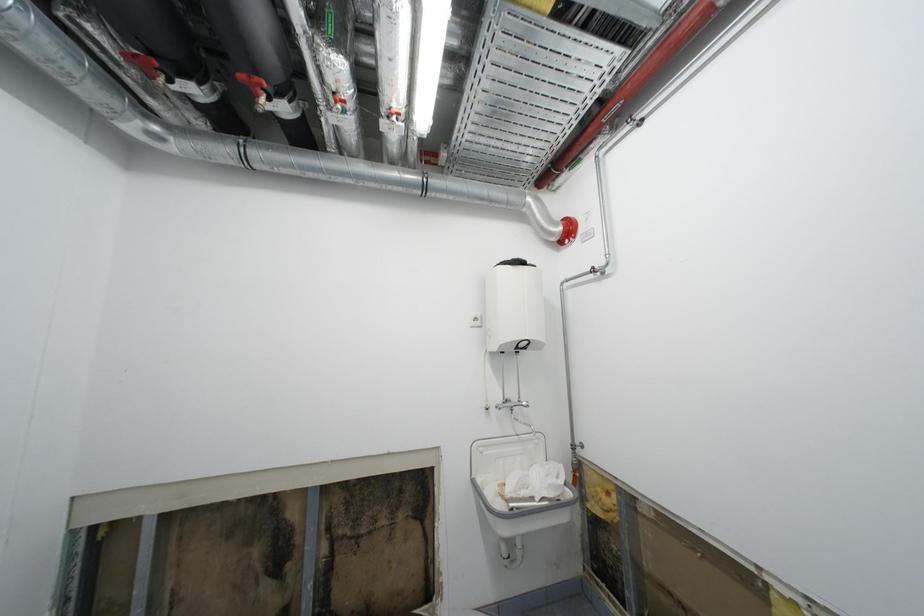
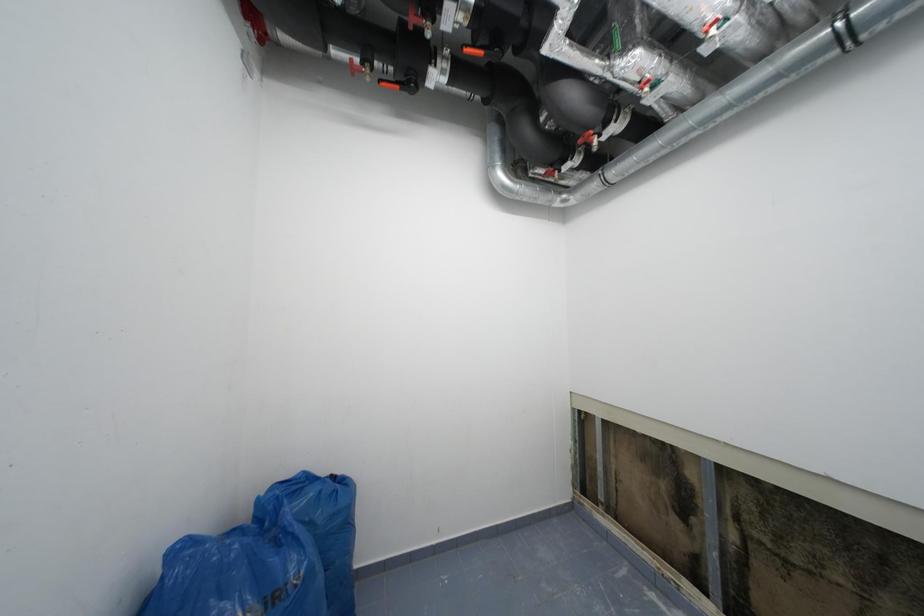
Question: The camera is either moving clockwise (left) or counter-clockwise (right) around the object. The first image is from the beginning of the video and the second image is from the end. Is the camera moving left or right when shooting the video?

Choices:
 (A) Left
 (B) Right

Answer: (B)